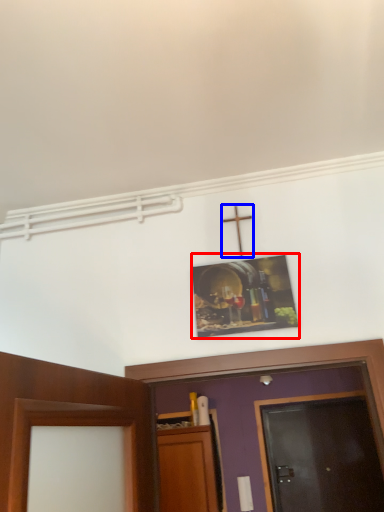
Question: Which of the following is the closest to the observer, picture frame (highlighted by a red box) or crucifix (highlighted by a blue box)?

Choices:
 (A) picture frame
 (B) crucifix

Answer: (A)